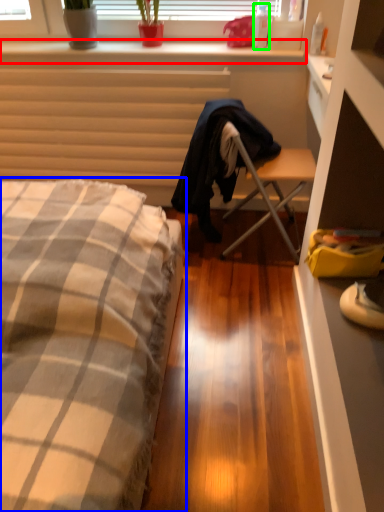
Question: Based on their relative distances, which object is farther from window sill (highlighted by a red box)? Choose from bed (highlighted by a blue box) and bottle (highlighted by a green box).

Choices:
 (A) bed
 (B) bottle

Answer: (A)